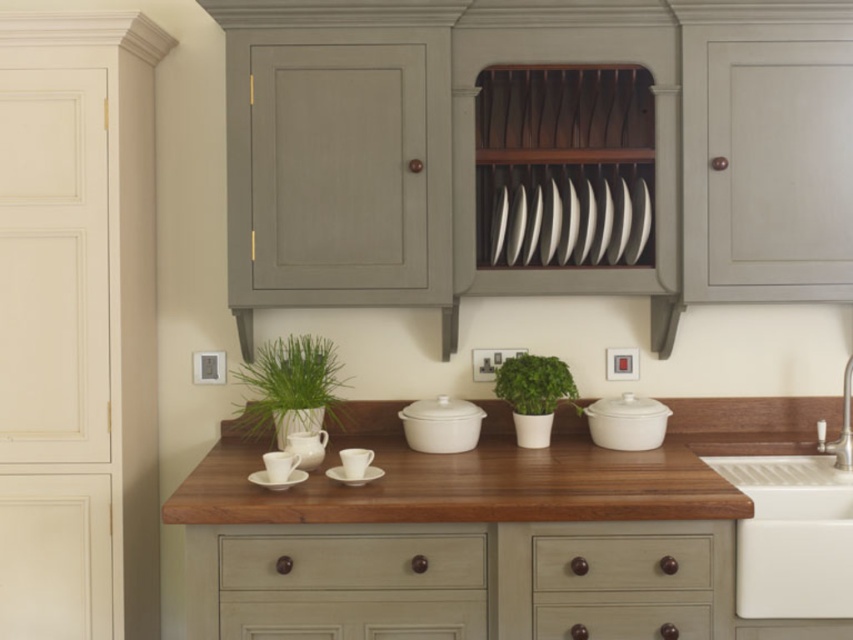
You are organizing the kitchen and need to place a new spice jar. The spice jar is small enough to fit on the counter between the matte gray drawer at lower center and the green matte plant at left. Can you fit it there?

The matte gray drawer at lower center is to the right of the green matte plant at left, so there is space between them for the spice jar.